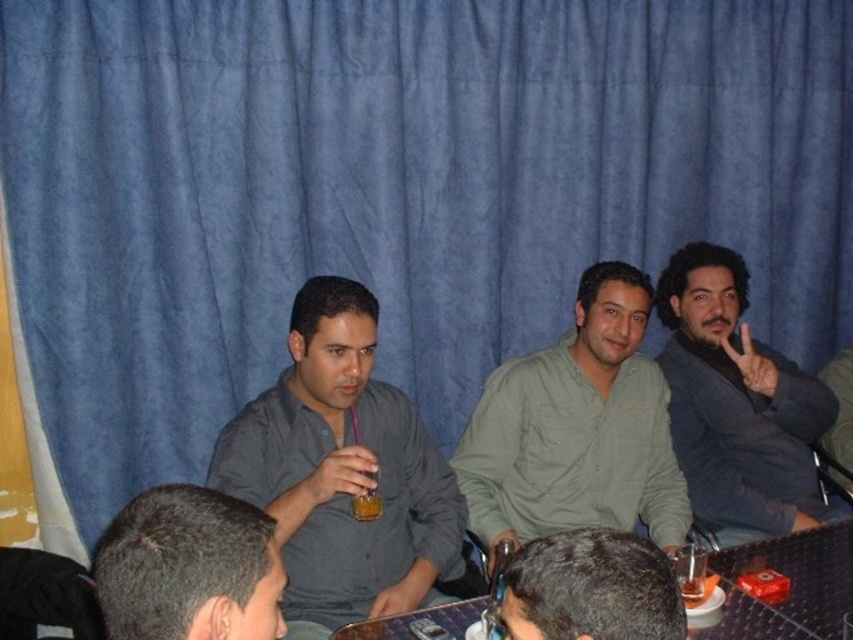
You are a photographer setting up a shoot in the room. You want to ensure that both the matte gray shirt at center and the dark blue suit at right are clearly visible in the photo. Given their positions, which one might you need to adjust the lighting for to ensure proper exposure?

The matte gray shirt at center is in front of dark blue suit at right, so the dark blue suit at right might be in shadow and require additional lighting to ensure proper exposure.

Based on the photo, you are a photographer setting up a photo shoot in the described scene. You need to adjust the lighting so that the matte gray shirt at center and the dark blue suit at right are both well lit. Considering their heights, which object should you place the light closer to?

The matte gray shirt at center has a lesser height compared to the dark blue suit at right, so you should place the light closer to the matte gray shirt at center to ensure both receive adequate lighting.